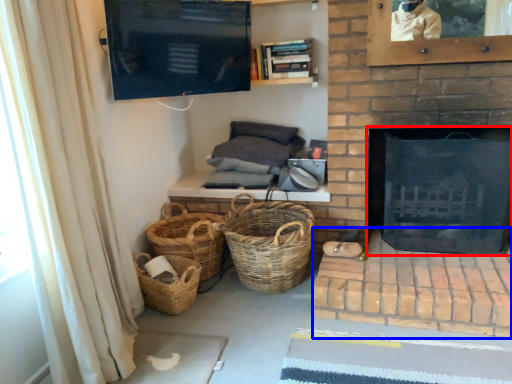
Question: Which point is further to the camera, fireplace (highlighted by a red box) or brickwork (highlighted by a blue box)?

Choices:
 (A) fireplace
 (B) brickwork

Answer: (A)